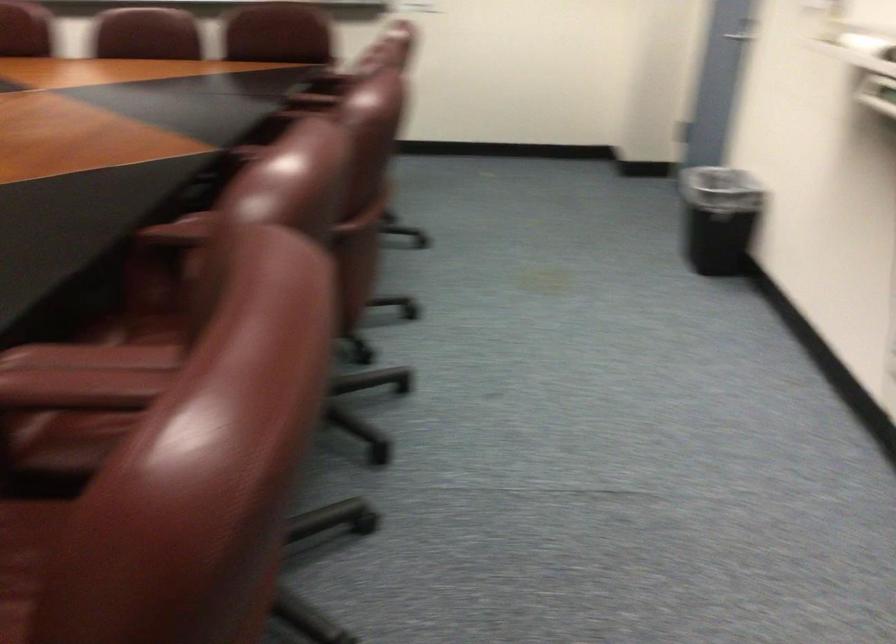
The height and width of the screenshot is (644, 896). What are the coordinates of `door handle` in the screenshot? It's located at (730, 20).